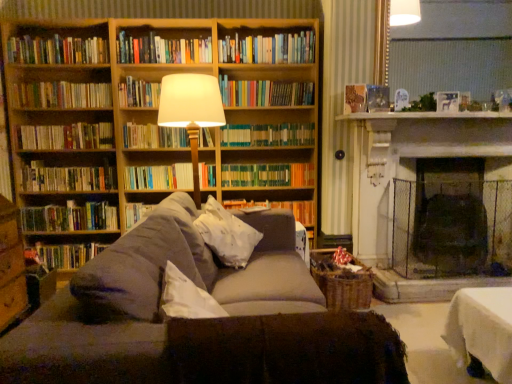
Question: Is hardcover book at left, which is counted as the fourteenth book, starting from the top, next to matte white lampshade at center and touching it?

Choices:
 (A) yes
 (B) no

Answer: (B)

Question: Considering the relative sizes of hardcover book at left, arranged as the 1th book when ordered from the bottom, and matte white lampshade at center in the image provided, is hardcover book at left, arranged as the 1th book when ordered from the bottom, wider than matte white lampshade at center?

Choices:
 (A) no
 (B) yes

Answer: (A)

Question: Does hardcover book at left, arranged as the 1th book when ordered from the bottom, have a smaller size compared to matte white lampshade at center?

Choices:
 (A) no
 (B) yes

Answer: (B)

Question: Is hardcover book at left, arranged as the 1th book when ordered from the bottom, further to the viewer compared to matte white lampshade at center?

Choices:
 (A) no
 (B) yes

Answer: (B)

Question: From a real-world perspective, is hardcover book at left, arranged as the 1th book when ordered from the bottom, located higher than matte white lampshade at center?

Choices:
 (A) yes
 (B) no

Answer: (B)

Question: From the image's perspective, relative to hardcover books at left, the 2th book in the bottom-to-top sequence, is hardcover books at left, acting as the seventh book starting from the bottom, above or below?

Choices:
 (A) below
 (B) above

Answer: (B)

Question: From their relative heights in the image, would you say hardcover books at left, arranged as the eighth book when viewed from the top, is taller or shorter than hardcover books at left, the thirteenth book when ordered from top to bottom?

Choices:
 (A) tall
 (B) short

Answer: (B)

Question: Is hardcover books at left, arranged as the eighth book when viewed from the top, bigger or smaller than hardcover books at left, the 2th book in the bottom-to-top sequence?

Choices:
 (A) big
 (B) small

Answer: (B)

Question: Based on their positions, is hardcover books at left, arranged as the eighth book when viewed from the top, located to the left or right of hardcover books at left, the thirteenth book when ordered from top to bottom?

Choices:
 (A) left
 (B) right

Answer: (A)

Question: In terms of width, does hardcover books at left, acting as the seventh book starting from the bottom, look wider or thinner when compared to white soft pillow at center?

Choices:
 (A) thin
 (B) wide

Answer: (A)

Question: Which is correct: hardcover books at left, arranged as the eighth book when viewed from the top, is inside white soft pillow at center, or outside of it?

Choices:
 (A) inside
 (B) outside

Answer: (B)

Question: In terms of height, does hardcover books at left, arranged as the eighth book when viewed from the top, look taller or shorter compared to white soft pillow at center?

Choices:
 (A) short
 (B) tall

Answer: (A)

Question: Does point (31, 142) appear closer or farther from the camera than point (210, 223)?

Choices:
 (A) closer
 (B) farther

Answer: (B)

Question: In terms of width, does hardcover books at upper left, the 10th book from the bottom, look wider or thinner when compared to wooden bookcase at upper left?

Choices:
 (A) wide
 (B) thin

Answer: (B)

Question: Visually, is hardcover books at upper left, the 10th book from the bottom, positioned to the left or to the right of wooden bookcase at upper left?

Choices:
 (A) left
 (B) right

Answer: (A)